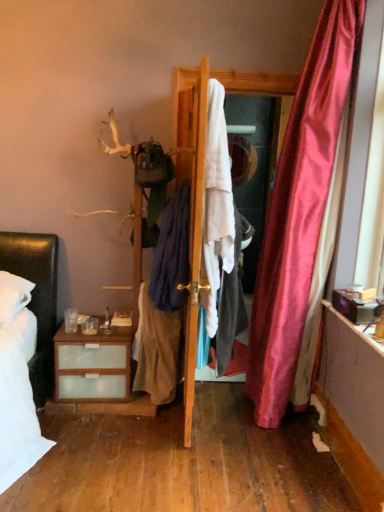
Question: Should I look upward or downward to see wooden door at center?

Choices:
 (A) down
 (B) up

Answer: (B)

Question: Is light brown fabric skirt at center, the third clothing viewed from the right, at the right side of matte white mirror at center?

Choices:
 (A) no
 (B) yes

Answer: (A)

Question: Is light brown fabric skirt at center, the third clothing viewed from the right, oriented away from matte white mirror at center?

Choices:
 (A) yes
 (B) no

Answer: (B)

Question: Is light brown fabric skirt at center, which ranks as the first clothing in left-to-right order, not close to matte white mirror at center?

Choices:
 (A) yes
 (B) no

Answer: (A)

Question: From a real-world perspective, is light brown fabric skirt at center, which ranks as the first clothing in left-to-right order, over matte white mirror at center?

Choices:
 (A) no
 (B) yes

Answer: (A)

Question: Considering the relative sizes of light brown fabric skirt at center, which ranks as the first clothing in left-to-right order, and matte white mirror at center in the image provided, is light brown fabric skirt at center, which ranks as the first clothing in left-to-right order, bigger than matte white mirror at center?

Choices:
 (A) no
 (B) yes

Answer: (B)

Question: Can you confirm if light brown fabric skirt at center, which ranks as the first clothing in left-to-right order, is positioned to the left of matte white mirror at center?

Choices:
 (A) yes
 (B) no

Answer: (A)

Question: Is the depth of wooden door at center less than that of white fabric at center?

Choices:
 (A) yes
 (B) no

Answer: (A)

Question: From a real-world perspective, does wooden door at center sit lower than white fabric at center?

Choices:
 (A) no
 (B) yes

Answer: (B)

Question: Is wooden door at center wider than white fabric at center?

Choices:
 (A) yes
 (B) no

Answer: (A)

Question: Does wooden door at center appear on the right side of white fabric at center?

Choices:
 (A) no
 (B) yes

Answer: (A)

Question: From the image's perspective, is wooden door at center located above white fabric at center?

Choices:
 (A) no
 (B) yes

Answer: (A)

Question: Are wooden door at center and white fabric at center far apart?

Choices:
 (A) yes
 (B) no

Answer: (B)

Question: Can you confirm if dark blue fabric at center, the second clothing from the left, is positioned to the right of wooden door at center?

Choices:
 (A) no
 (B) yes

Answer: (A)